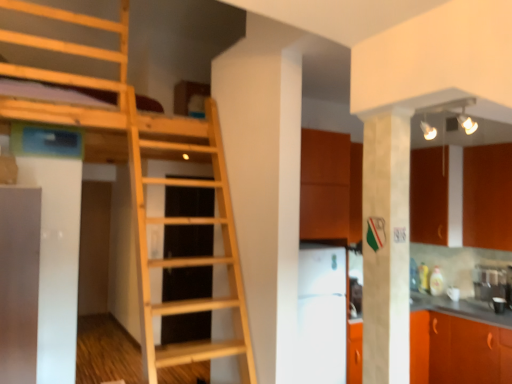
What do you see at coordinates (322, 315) in the screenshot? The height and width of the screenshot is (384, 512). I see `white glossy refrigerator at center` at bounding box center [322, 315].

What do you see at coordinates (186, 224) in the screenshot? Image resolution: width=512 pixels, height=384 pixels. I see `light wood ladder at center` at bounding box center [186, 224].

This screenshot has height=384, width=512. Describe the element at coordinates (458, 350) in the screenshot. I see `orange matte cabinet at lower right, the first cabinetry in the bottom-to-top sequence` at that location.

Image resolution: width=512 pixels, height=384 pixels. What do you see at coordinates (386, 246) in the screenshot?
I see `white marble pillar at center` at bounding box center [386, 246].

Find the location of a particular element. This screenshot has height=384, width=512. white glossy refrigerator at center is located at coordinates [x=322, y=315].

Would you consider orange matte cabinet at lower right, the first cabinetry in the bottom-to-top sequence, to be distant from light wood ladder at center?

Yes.

From the image's perspective, which is above, orange matte cabinet at lower right, positioned as the 2th cabinetry in top-to-bottom order, or light wood ladder at center?

light wood ladder at center, from the image's perspective.

From a real-world perspective, is orange matte cabinet at lower right, positioned as the 2th cabinetry in top-to-bottom order, physically above light wood ladder at center?

Incorrect, from a real-world perspective, orange matte cabinet at lower right, positioned as the 2th cabinetry in top-to-bottom order, is lower than light wood ladder at center.

Is orange matte cabinet at lower right, positioned as the 2th cabinetry in top-to-bottom order, facing towards light wood ladder at center?

Yes, orange matte cabinet at lower right, positioned as the 2th cabinetry in top-to-bottom order, is aimed at light wood ladder at center.

Is light wood ladder at center facing towards orange matte cabinet at right, which is counted as the 1th cabinetry, starting from the top?

No, light wood ladder at center is not oriented towards orange matte cabinet at right, which is counted as the 1th cabinetry, starting from the top.

Is point (232, 279) closer or farther from the camera than point (490, 230)?

Point (232, 279) is closer to the camera than point (490, 230).

Considering the relative positions of light wood ladder at center and orange matte cabinet at right, which is counted as the 1th cabinetry, starting from the top, in the image provided, is light wood ladder at center to the left of orange matte cabinet at right, which is counted as the 1th cabinetry, starting from the top, from the viewer's perspective?

Yes, light wood ladder at center is to the left of orange matte cabinet at right, which is counted as the 1th cabinetry, starting from the top.

From the image's perspective, which one is positioned lower, light wood ladder at center or orange matte cabinet at right, which is counted as the 1th cabinetry, starting from the top?

light wood ladder at center appears lower in the image.

From the picture: In terms of size, does orange matte cabinet at right, which is counted as the 1th cabinetry, starting from the top, appear bigger or smaller than orange matte cabinet at lower right, positioned as the 2th cabinetry in top-to-bottom order?

orange matte cabinet at right, which is counted as the 1th cabinetry, starting from the top, is smaller than orange matte cabinet at lower right, positioned as the 2th cabinetry in top-to-bottom order.

Between orange matte cabinet at right, which is counted as the 1th cabinetry, starting from the top, and orange matte cabinet at lower right, the first cabinetry in the bottom-to-top sequence, which one is positioned behind?

orange matte cabinet at right, which is counted as the 1th cabinetry, starting from the top, is more distant.

Between orange matte cabinet at right, which is counted as the 1th cabinetry, starting from the top, and orange matte cabinet at lower right, positioned as the 2th cabinetry in top-to-bottom order, which one appears on the left side from the viewer's perspective?

orange matte cabinet at lower right, positioned as the 2th cabinetry in top-to-bottom order, is more to the left.

Consider the image. Could you tell me if orange matte cabinet at right, which is counted as the 1th cabinetry, starting from the top, is facing orange matte cabinet at lower right, the first cabinetry in the bottom-to-top sequence?

No.

From the image's perspective, which is above, orange matte cabinet at right, which is counted as the 1th cabinetry, starting from the top, or white marble pillar at center?

orange matte cabinet at right, which is counted as the 1th cabinetry, starting from the top, appears higher in the image.

Is orange matte cabinet at right, which is counted as the 1th cabinetry, starting from the top, far away from white marble pillar at center?

That's right, there is a large distance between orange matte cabinet at right, which is counted as the 1th cabinetry, starting from the top, and white marble pillar at center.

Is there a large distance between orange matte cabinet at right, which is counted as the 1th cabinetry, starting from the top, and white glossy refrigerator at center?

Yes, orange matte cabinet at right, which is counted as the 1th cabinetry, starting from the top, and white glossy refrigerator at center are quite far apart.

From a real-world perspective, is orange matte cabinet at right, which is counted as the 1th cabinetry, starting from the top, positioned over white glossy refrigerator at center based on gravity?

Yes, from a real-world perspective, orange matte cabinet at right, which is counted as the 1th cabinetry, starting from the top, is above white glossy refrigerator at center.

Is orange matte cabinet at right, which appears as the second cabinetry when ordered from the bottom, aimed at white glossy refrigerator at center?

Yes, orange matte cabinet at right, which appears as the second cabinetry when ordered from the bottom, is turned towards white glossy refrigerator at center.

Is light wood ladder at center not near orange matte cabinet at lower right, positioned as the 2th cabinetry in top-to-bottom order?

Yes, light wood ladder at center and orange matte cabinet at lower right, positioned as the 2th cabinetry in top-to-bottom order, are located far from each other.

Could you tell me if light wood ladder at center is turned towards orange matte cabinet at lower right, positioned as the 2th cabinetry in top-to-bottom order?

No, light wood ladder at center is not oriented towards orange matte cabinet at lower right, positioned as the 2th cabinetry in top-to-bottom order.

Which is more to the left, light wood ladder at center or orange matte cabinet at lower right, the first cabinetry in the bottom-to-top sequence?

light wood ladder at center is more to the left.

Is light wood ladder at center located outside orange matte cabinet at lower right, the first cabinetry in the bottom-to-top sequence?

Yes.

Which of these two, orange matte cabinet at lower right, the first cabinetry in the bottom-to-top sequence, or orange matte cabinet at right, which is counted as the 1th cabinetry, starting from the top, is smaller?

orange matte cabinet at right, which is counted as the 1th cabinetry, starting from the top.

Is orange matte cabinet at lower right, positioned as the 2th cabinetry in top-to-bottom order, wider or thinner than orange matte cabinet at right, which is counted as the 1th cabinetry, starting from the top?

Clearly, orange matte cabinet at lower right, positioned as the 2th cabinetry in top-to-bottom order, has more width compared to orange matte cabinet at right, which is counted as the 1th cabinetry, starting from the top.

Considering the positions of points (410, 366) and (481, 242), is point (410, 366) closer to camera compared to point (481, 242)?

No.

From a real-world perspective, who is located higher, orange matte cabinet at lower right, the first cabinetry in the bottom-to-top sequence, or orange matte cabinet at right, which appears as the second cabinetry when ordered from the bottom?

orange matte cabinet at right, which appears as the second cabinetry when ordered from the bottom, from a real-world perspective.

This screenshot has width=512, height=384. What are the coordinates of `ladder located above the orange matte cabinet at lower right, the first cabinetry in the bottom-to-top sequence (from the image's perspective)` in the screenshot? It's located at (186, 224).

From the light wood ladder at center, count 2nd cabinetrys backward and point to it. Please provide its 2D coordinates.

[(487, 196)]

Which object lies nearer to the anchor point white marble pillar at center, light wood ladder at center or white glossy refrigerator at center?

Among the two, white glossy refrigerator at center is located nearer to white marble pillar at center.

Estimate the real-world distances between objects in this image. Which object is closer to light wood ladder at center, orange matte cabinet at right, which is counted as the 1th cabinetry, starting from the top, or white glossy refrigerator at center?

The object closer to light wood ladder at center is white glossy refrigerator at center.

When comparing their distances from white glossy refrigerator at center, does white marble pillar at center or orange matte cabinet at right, which is counted as the 1th cabinetry, starting from the top, seem further?

orange matte cabinet at right, which is counted as the 1th cabinetry, starting from the top, is positioned further to the anchor white glossy refrigerator at center.

Which object lies nearer to the anchor point light wood ladder at center, orange matte cabinet at right, which is counted as the 1th cabinetry, starting from the top, or white marble pillar at center?

Among the two, white marble pillar at center is located nearer to light wood ladder at center.

From the image, which object appears to be farther from orange matte cabinet at right, which is counted as the 1th cabinetry, starting from the top, white glossy refrigerator at center or white marble pillar at center?

Based on the image, white marble pillar at center appears to be further to orange matte cabinet at right, which is counted as the 1th cabinetry, starting from the top.

Estimate the real-world distances between objects in this image. Which object is closer to orange matte cabinet at lower right, positioned as the 2th cabinetry in top-to-bottom order, white glossy refrigerator at center or white marble pillar at center?

The object closer to orange matte cabinet at lower right, positioned as the 2th cabinetry in top-to-bottom order, is white glossy refrigerator at center.

Looking at the image, which one is located closer to white glossy refrigerator at center, white marble pillar at center or orange matte cabinet at lower right, positioned as the 2th cabinetry in top-to-bottom order?

orange matte cabinet at lower right, positioned as the 2th cabinetry in top-to-bottom order, is positioned closer to the anchor white glossy refrigerator at center.

Based on their spatial positions, is light wood ladder at center or orange matte cabinet at lower right, the first cabinetry in the bottom-to-top sequence, closer to orange matte cabinet at right, which appears as the second cabinetry when ordered from the bottom?

orange matte cabinet at lower right, the first cabinetry in the bottom-to-top sequence.

I want to click on pillar situated between white glossy refrigerator at center and orange matte cabinet at right, which is counted as the 1th cabinetry, starting from the top, from left to right, so click(x=386, y=246).

The height and width of the screenshot is (384, 512). Find the location of `ladder between white marble pillar at center and white glossy refrigerator at center from front to back`. ladder between white marble pillar at center and white glossy refrigerator at center from front to back is located at coordinates coord(186,224).

In order to click on cabinetry situated between light wood ladder at center and orange matte cabinet at right, which appears as the second cabinetry when ordered from the bottom, from left to right in this screenshot , I will do `click(458, 350)`.

In order to click on pillar situated between light wood ladder at center and orange matte cabinet at right, which appears as the second cabinetry when ordered from the bottom, from left to right in this screenshot , I will do `click(386, 246)`.